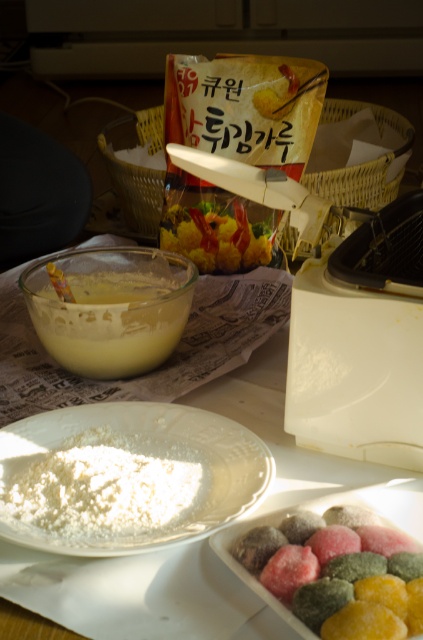
You are a chef preparing a dish and need to choose between the white matte plate at center and the yellow matte bowl at center. Which one has a bigger surface area for arranging ingredients?

The white matte plate at center is larger in size than the yellow matte bowl at center, so it has a bigger surface area for arranging ingredients.